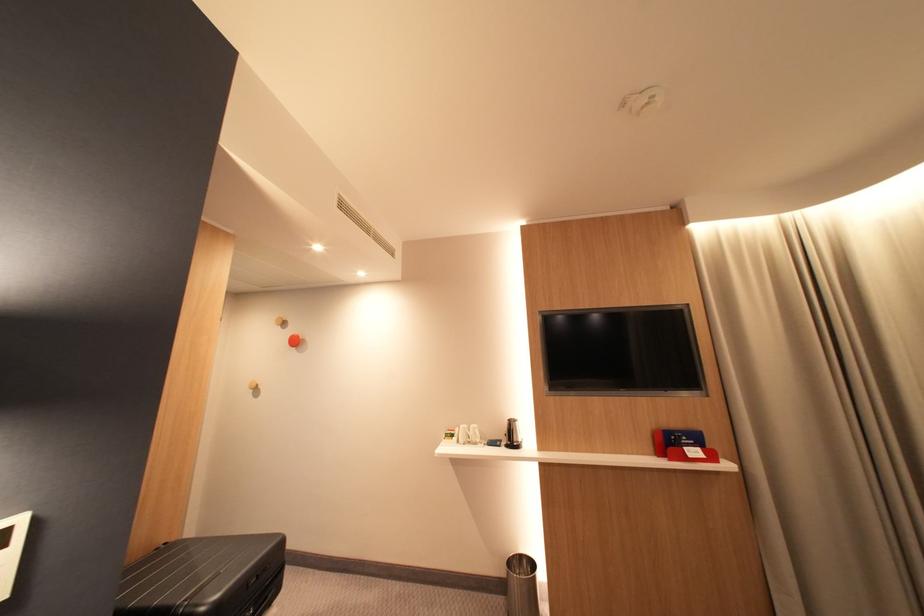
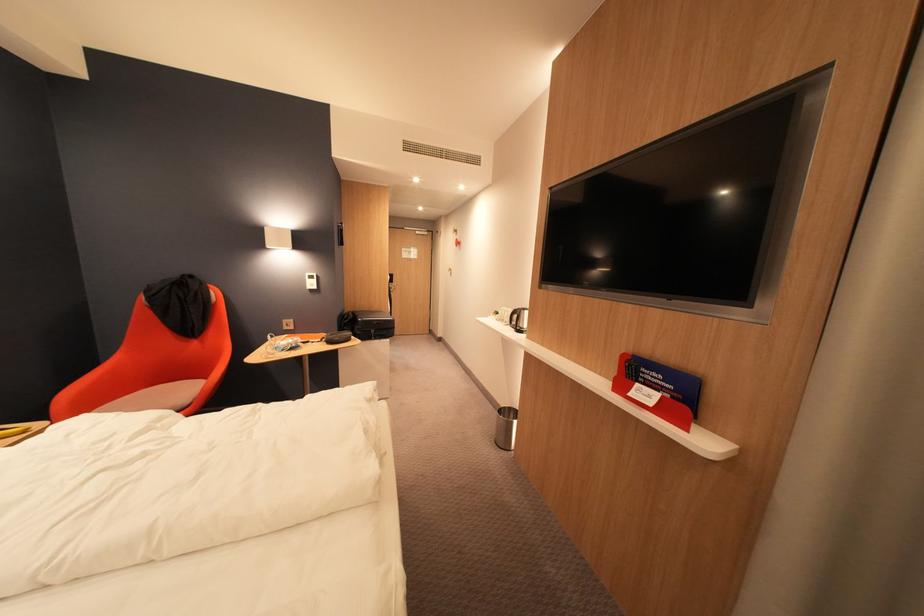
In the second image, find the point that corresponds to point (696, 450) in the first image.

(648, 386)